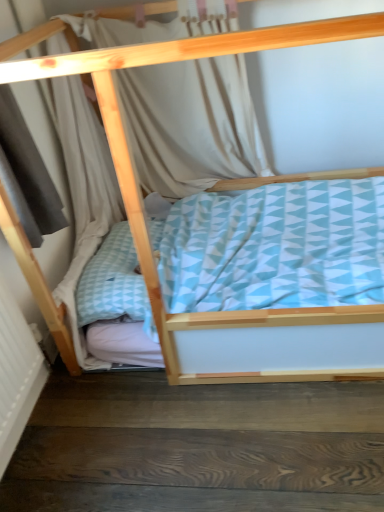
Locate an element on the screen. The image size is (384, 512). free space above dark wood stair at lower left (from a real-world perspective) is located at coordinates (192, 432).